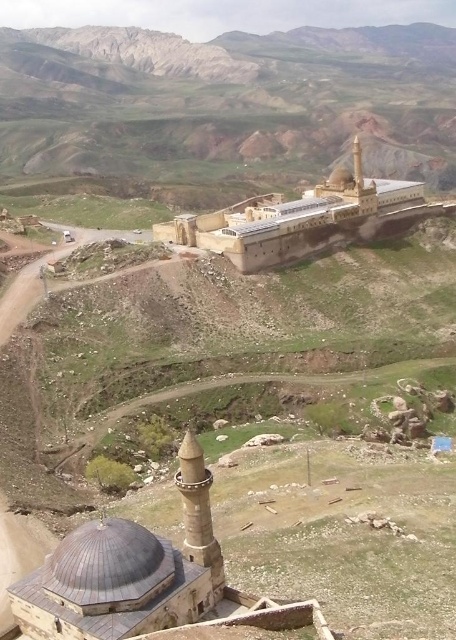
What do you see at coordinates (228, 100) in the screenshot? I see `brown rocky mountain at upper center` at bounding box center [228, 100].

Is point (355, 84) closer to camera compared to point (409, 189)?

No.

Where is `brown rocky mountain at upper center`? This screenshot has height=640, width=456. brown rocky mountain at upper center is located at coordinates (228, 100).

The height and width of the screenshot is (640, 456). I want to click on brown rocky mountain at upper center, so click(228, 100).